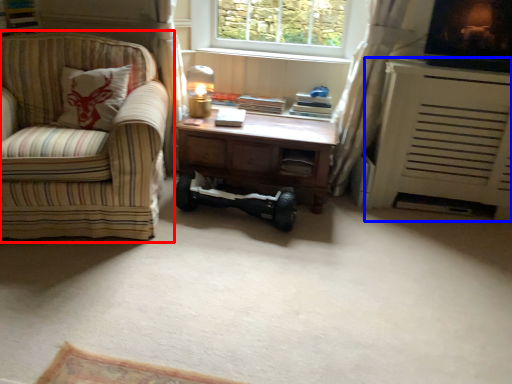
Question: Which point is further to the camera, studio couch (highlighted by a red box) or heater (highlighted by a blue box)?

Choices:
 (A) studio couch
 (B) heater

Answer: (B)